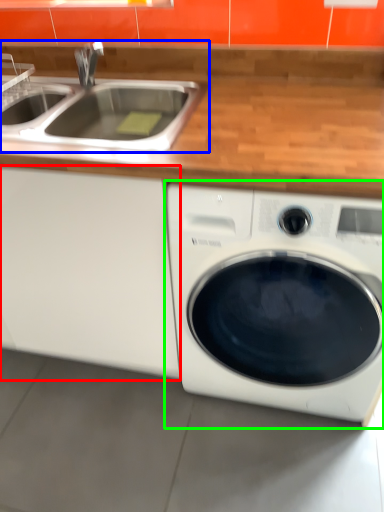
Question: Considering the real-world distances, which object is farthest from cabinetry (highlighted by a red box)? sink (highlighted by a blue box) or washing machine (highlighted by a green box)?

Choices:
 (A) sink
 (B) washing machine

Answer: (A)